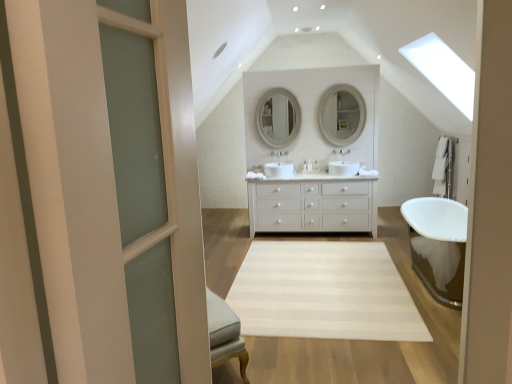
Describe the element at coordinates (342, 164) in the screenshot. I see `white glossy sink at center` at that location.

The height and width of the screenshot is (384, 512). What do you see at coordinates (341, 115) in the screenshot?
I see `matte white mirror at upper center, the 2th mirror positioned from the left` at bounding box center [341, 115].

The image size is (512, 384). I want to click on clear glass door at left, so click(99, 192).

Visually, is white glossy sink at center positioned to the left or to the right of clear glass door at left?

white glossy sink at center is to the right of clear glass door at left.

Is white glossy sink at center turned away from clear glass door at left?

white glossy sink at center does not have its back to clear glass door at left.

Is white glossy sink at center beside clear glass door at left?

white glossy sink at center and clear glass door at left are clearly separated.

What's the angular difference between white glossy sink at center and clear glass door at left's facing directions?

They differ by 81.6 degrees in their facing directions.

Is matte white mirror at center, positioned as the 2th mirror in right-to-left order, far from white matte cabinet at center?

Absolutely, matte white mirror at center, positioned as the 2th mirror in right-to-left order, is distant from white matte cabinet at center.

In order to click on the 2nd mirror behind the white matte cabinet at center, starting your count from the anchor in this screenshot , I will do `click(278, 119)`.

Looking at this image, can you tell me how much matte white mirror at center, which is the first mirror from left to right, and white matte cabinet at center differ in facing direction?

The angle between the facing direction of matte white mirror at center, which is the first mirror from left to right, and the facing direction of white matte cabinet at center is 0.000948 degrees.

From the image's perspective, is matte white mirror at center, positioned as the 2th mirror in right-to-left order, under white matte cabinet at center?

No, from the image's perspective, matte white mirror at center, positioned as the 2th mirror in right-to-left order, is not below white matte cabinet at center.

From the picture: How distant is matte white mirror at center, which is the first mirror from left to right, from white striped rug at center?

A distance of 8.22 feet exists between matte white mirror at center, which is the first mirror from left to right, and white striped rug at center.

Is matte white mirror at center, which is the first mirror from left to right, completely or partially outside of white striped rug at center?

That's correct, matte white mirror at center, which is the first mirror from left to right, is outside of white striped rug at center.

Considering their positions, is matte white mirror at center, positioned as the 2th mirror in right-to-left order, located in front of or behind white striped rug at center?

Clearly, matte white mirror at center, positioned as the 2th mirror in right-to-left order, is behind white striped rug at center.

Does matte white mirror at center, positioned as the 2th mirror in right-to-left order, have a lesser width compared to white striped rug at center?

Yes, matte white mirror at center, positioned as the 2th mirror in right-to-left order, is thinner than white striped rug at center.

Does matte white mirror at center, positioned as the 2th mirror in right-to-left order, appear on the right side of clear glass door at left?

Yes.

Is point (275, 105) closer or farther from the camera than point (163, 137)?

Point (275, 105).

From a real-world perspective, who is located lower, matte white mirror at center, which is the first mirror from left to right, or clear glass door at left?

clear glass door at left, from a real-world perspective.

Based on the photo, considering the relative sizes of matte white mirror at center, positioned as the 2th mirror in right-to-left order, and clear glass door at left in the image provided, is matte white mirror at center, positioned as the 2th mirror in right-to-left order, taller than clear glass door at left?

No, matte white mirror at center, positioned as the 2th mirror in right-to-left order, is not taller than clear glass door at left.

In terms of width, does white glossy sink at center look wider or thinner when compared to white matte cabinet at center?

Clearly, white glossy sink at center has less width compared to white matte cabinet at center.

Is white glossy sink at center oriented away from white matte cabinet at center?

white glossy sink at center is not turned away from white matte cabinet at center.

Between point (345, 152) and point (251, 217), which one is positioned in front?

Point (251, 217)

Can you tell me how much white glossy sink at center and white matte cabinet at center differ in facing direction?

The angular difference between white glossy sink at center and white matte cabinet at center is 8.89e-05 degrees.

How far apart are matte white mirror at upper center, arranged as the first mirror when viewed from the right, and white glossy sink at center?

matte white mirror at upper center, arranged as the first mirror when viewed from the right, and white glossy sink at center are 18.80 inches apart.

Is matte white mirror at upper center, the 2th mirror positioned from the left, looking in the opposite direction of white glossy sink at center?

matte white mirror at upper center, the 2th mirror positioned from the left, is not turned away from white glossy sink at center.

From a real-world perspective, who is located lower, matte white mirror at upper center, arranged as the first mirror when viewed from the right, or white glossy sink at center?

In real-world perspective, white glossy sink at center is lower.

Where is `mirror that is the 1st one when counting upward from the white glossy sink at center (from the image's perspective)`? mirror that is the 1st one when counting upward from the white glossy sink at center (from the image's perspective) is located at coordinates (341, 115).

From a real-world perspective, between white ceramic faucet at center and matte white mirror at upper center, arranged as the first mirror when viewed from the right, who is vertically lower?

From a 3D spatial view, white ceramic faucet at center is below.

Looking at this image, which object is positioned more to the right, white ceramic faucet at center or matte white mirror at upper center, the 2th mirror positioned from the left?

From the viewer's perspective, matte white mirror at upper center, the 2th mirror positioned from the left, appears more on the right side.

From the image's perspective, is white ceramic faucet at center located above or below matte white mirror at upper center, the 2th mirror positioned from the left?

white ceramic faucet at center is situated lower than matte white mirror at upper center, the 2th mirror positioned from the left, in the image.

Is white ceramic faucet at center surrounding matte white mirror at upper center, the 2th mirror positioned from the left?

No, white ceramic faucet at center does not contain matte white mirror at upper center, the 2th mirror positioned from the left.

I want to click on sink on the right of clear glass door at left, so click(x=342, y=164).

Identify the location of bathroom cabinet lying in front of the matte white mirror at center, which is the first mirror from left to right. (312, 204).

Looking at the image, which one is located closer to matte white mirror at upper center, arranged as the first mirror when viewed from the right, white ceramic faucet at center or white striped rug at center?

The object closer to matte white mirror at upper center, arranged as the first mirror when viewed from the right, is white ceramic faucet at center.

Which object lies nearer to the anchor point matte white mirror at upper center, the 2th mirror positioned from the left, white matte cabinet at center or white glossy sink at center?

white glossy sink at center is closer to matte white mirror at upper center, the 2th mirror positioned from the left.

From the image, which object appears to be nearer to clear glass door at left, white matte cabinet at center or white ceramic faucet at center?

white matte cabinet at center is positioned closer to the anchor clear glass door at left.

Looking at the image, which one is located further to clear glass door at left, white matte cabinet at center or white glossy sink at center?

Based on the image, white glossy sink at center appears to be further to clear glass door at left.

When comparing their distances from white matte cabinet at center, does white ceramic faucet at center or white glossy sink at center seem closer?

white glossy sink at center lies closer to white matte cabinet at center than the other object.

Looking at the image, which one is located closer to matte white mirror at upper center, the 2th mirror positioned from the left, white ceramic faucet at center or matte white mirror at center, which is the first mirror from left to right?

matte white mirror at center, which is the first mirror from left to right, is positioned closer to the anchor matte white mirror at upper center, the 2th mirror positioned from the left.

Considering their positions, is white ceramic faucet at center positioned further to white glossy sink at center than white matte cabinet at center?

The object further to white glossy sink at center is white ceramic faucet at center.

Looking at the image, which one is located closer to white matte cabinet at center, white ceramic faucet at center or clear glass door at left?

white ceramic faucet at center is closer to white matte cabinet at center.

Find the location of a particular element. This screenshot has width=512, height=384. bathroom cabinet between clear glass door at left and matte white mirror at upper center, arranged as the first mirror when viewed from the right, along the z-axis is located at coordinates (312, 204).

The width and height of the screenshot is (512, 384). What are the coordinates of `faucet that lies between matte white mirror at center, positioned as the 2th mirror in right-to-left order, and white matte cabinet at center from top to bottom` in the screenshot? It's located at pos(279,153).

The image size is (512, 384). I want to click on sink between clear glass door at left and matte white mirror at center, positioned as the 2th mirror in right-to-left order, along the z-axis, so click(342, 164).

Where is `plain located between clear glass door at left and matte white mirror at upper center, arranged as the first mirror when viewed from the right, in the depth direction`? plain located between clear glass door at left and matte white mirror at upper center, arranged as the first mirror when viewed from the right, in the depth direction is located at coordinates (324, 292).